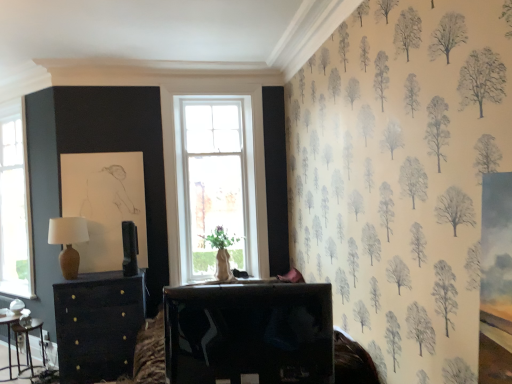
Question: Considering the relative sizes of shiny black tv at center, which is the third table from left to right, and matte brown table lamp at left in the image provided, is shiny black tv at center, which is the third table from left to right, bigger than matte brown table lamp at left?

Choices:
 (A) yes
 (B) no

Answer: (A)

Question: Could you tell me if shiny black tv at center, which is the third table from left to right, is facing matte brown table lamp at left?

Choices:
 (A) no
 (B) yes

Answer: (A)

Question: From a real-world perspective, does shiny black tv at center, placed as the 3th table when sorted from back to front, stand above matte brown table lamp at left?

Choices:
 (A) no
 (B) yes

Answer: (A)

Question: Is the surface of shiny black tv at center, placed as the 3th table when sorted from back to front, in direct contact with matte brown table lamp at left?

Choices:
 (A) no
 (B) yes

Answer: (A)

Question: Does shiny black tv at center, placed as the 3th table when sorted from back to front, appear on the left side of matte brown table lamp at left?

Choices:
 (A) yes
 (B) no

Answer: (B)

Question: Is shiny black tv at center, placed as the first table when sorted from front to back, taller than matte brown table lamp at left?

Choices:
 (A) yes
 (B) no

Answer: (A)

Question: From the image's perspective, is wooden table at lower left, which is counted as the 1th table, starting from the back, located beneath shiny black tv at center, arranged as the first table when viewed from the right?

Choices:
 (A) yes
 (B) no

Answer: (A)

Question: Is wooden table at lower left, which is the 3th table in front-to-back order, to the left of shiny black tv at center, placed as the 3th table when sorted from back to front, from the viewer's perspective?

Choices:
 (A) yes
 (B) no

Answer: (A)

Question: Considering the relative sizes of wooden table at lower left, which is counted as the 1th table, starting from the back, and shiny black tv at center, placed as the 3th table when sorted from back to front, in the image provided, is wooden table at lower left, which is counted as the 1th table, starting from the back, shorter than shiny black tv at center, placed as the 3th table when sorted from back to front,?

Choices:
 (A) yes
 (B) no

Answer: (A)

Question: Is wooden table at lower left, which is counted as the 1th table, starting from the back, far from shiny black tv at center, placed as the first table when sorted from front to back?

Choices:
 (A) yes
 (B) no

Answer: (A)

Question: Is wooden table at lower left, which is counted as the second table, starting from the left, bigger than shiny black tv at center, arranged as the first table when viewed from the right?

Choices:
 (A) no
 (B) yes

Answer: (A)

Question: Is wooden table at lower left, which is counted as the 1th table, starting from the back, facing towards shiny black tv at center, arranged as the first table when viewed from the right?

Choices:
 (A) yes
 (B) no

Answer: (B)

Question: Would you say metallic silver table at lower left, the second table from the front, is part of shiny black tv at center, arranged as the first table when viewed from the right,'s contents?

Choices:
 (A) yes
 (B) no

Answer: (B)